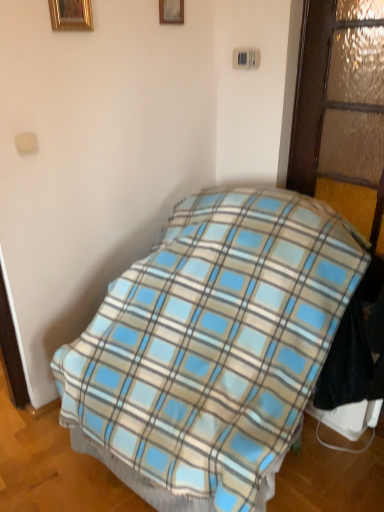
Question: Does wooden picture frame at upper center, which appears as the first picture frame when viewed from the back, have a greater width compared to gold metallic picture frame at upper left, the second picture frame in the right-to-left sequence?

Choices:
 (A) yes
 (B) no

Answer: (B)

Question: Is wooden picture frame at upper center, which appears as the first picture frame when viewed from the back, not within gold metallic picture frame at upper left, which is the second picture frame in back-to-front order?

Choices:
 (A) no
 (B) yes

Answer: (B)

Question: Does wooden picture frame at upper center, placed as the first picture frame when sorted from right to left, come behind gold metallic picture frame at upper left, the second picture frame in the right-to-left sequence?

Choices:
 (A) no
 (B) yes

Answer: (B)

Question: Is wooden picture frame at upper center, placed as the first picture frame when sorted from right to left, smaller than gold metallic picture frame at upper left, the first picture frame viewed from the left?

Choices:
 (A) no
 (B) yes

Answer: (B)

Question: Would you consider wooden picture frame at upper center, arranged as the 2th picture frame when viewed from the left, to be distant from gold metallic picture frame at upper left, which is the second picture frame in back-to-front order?

Choices:
 (A) no
 (B) yes

Answer: (A)

Question: From the image's perspective, does wooden picture frame at upper center, the 2th picture frame when ordered from front to back, appear lower than gold metallic picture frame at upper left, acting as the 1th picture frame starting from the front?

Choices:
 (A) yes
 (B) no

Answer: (B)

Question: Are textured frosted glass door at right and blue plaid blanket at center far apart?

Choices:
 (A) no
 (B) yes

Answer: (A)

Question: Is textured frosted glass door at right aimed at blue plaid blanket at center?

Choices:
 (A) yes
 (B) no

Answer: (A)

Question: Is textured frosted glass door at right taller than blue plaid blanket at center?

Choices:
 (A) yes
 (B) no

Answer: (B)

Question: Is textured frosted glass door at right thinner than blue plaid blanket at center?

Choices:
 (A) yes
 (B) no

Answer: (A)

Question: Considering the relative positions of textured frosted glass door at right and blue plaid blanket at center in the image provided, is textured frosted glass door at right in front of blue plaid blanket at center?

Choices:
 (A) no
 (B) yes

Answer: (A)

Question: Does textured frosted glass door at right have a larger size compared to blue plaid blanket at center?

Choices:
 (A) no
 (B) yes

Answer: (A)

Question: From the image's perspective, would you say wooden picture frame at upper center, arranged as the 2th picture frame when viewed from the left, is positioned over blue plaid blanket at center?

Choices:
 (A) no
 (B) yes

Answer: (B)